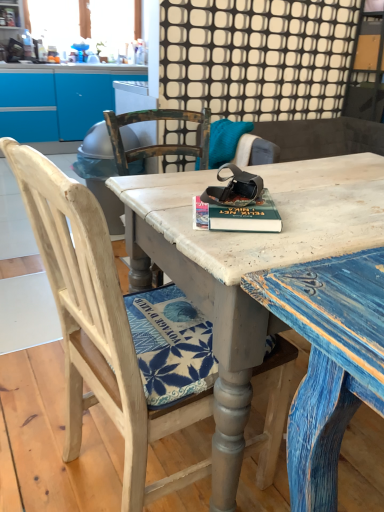
The height and width of the screenshot is (512, 384). What are the coordinates of `free location to the left of hardcover book at center` in the screenshot? It's located at (166, 204).